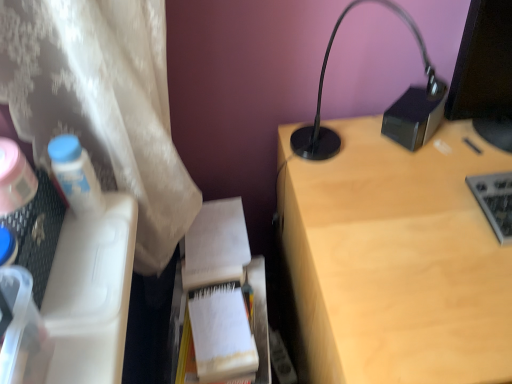
Where is `free spot to the left of black glossy monitor at upper right`? free spot to the left of black glossy monitor at upper right is located at coordinates (404, 154).